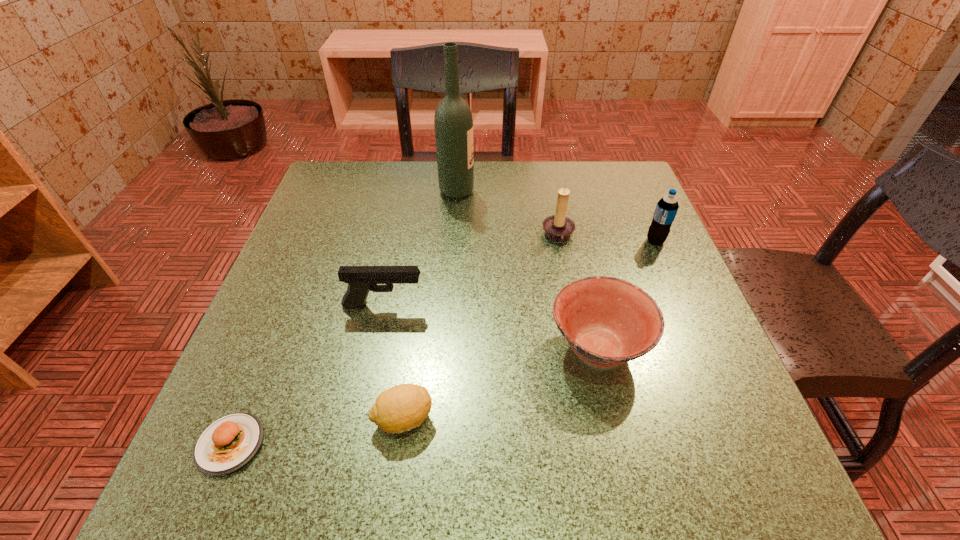
In the image, there is a desktop. Identify the location of vacant area at the near left corner. (204, 478).

Find the location of a particular element. free spot between the lemon and the bowl is located at coordinates (500, 383).

You are a GUI agent. You are given a task and a screenshot of the screen. Output one action in this format:
    pyautogui.click(x=<x>, y=<y>)
    Task: Click on the empty space between the candle holder and the fourth farthest object
    
    Given the screenshot: What is the action you would take?
    pyautogui.click(x=471, y=271)

Locate an element on the screen. free point between the soda bottle and the candle holder is located at coordinates (607, 239).

Find the location of a particular element. The image size is (960, 540). unoccupied position between the rightmost object and the candle holder is located at coordinates (607, 239).

Where is `vacant space in between the soda bottle and the leftmost object`? vacant space in between the soda bottle and the leftmost object is located at coordinates (443, 343).

Locate an element on the screen. This screenshot has width=960, height=540. free space between the bowl and the pistol is located at coordinates (491, 327).

Select which object appears as the second closest to the bowl. Please provide its 2D coordinates. Your answer should be formatted as a tuple, i.e. [(x, y)], where the tuple contains the x and y coordinates of a point satisfying the conditions above.

[(403, 407)]

At what (x,y) coordinates should I click in order to perform the action: click on object identified as the fourth closest to the candle holder. Please return your answer as a coordinate pair (x, y). Image resolution: width=960 pixels, height=540 pixels. Looking at the image, I should click on (361, 279).

Locate an element on the screen. The width and height of the screenshot is (960, 540). free space that satisfies the following two spatial constraints: 1. on the front-facing side of the pistol; 2. on the right side of the bowl is located at coordinates (375, 348).